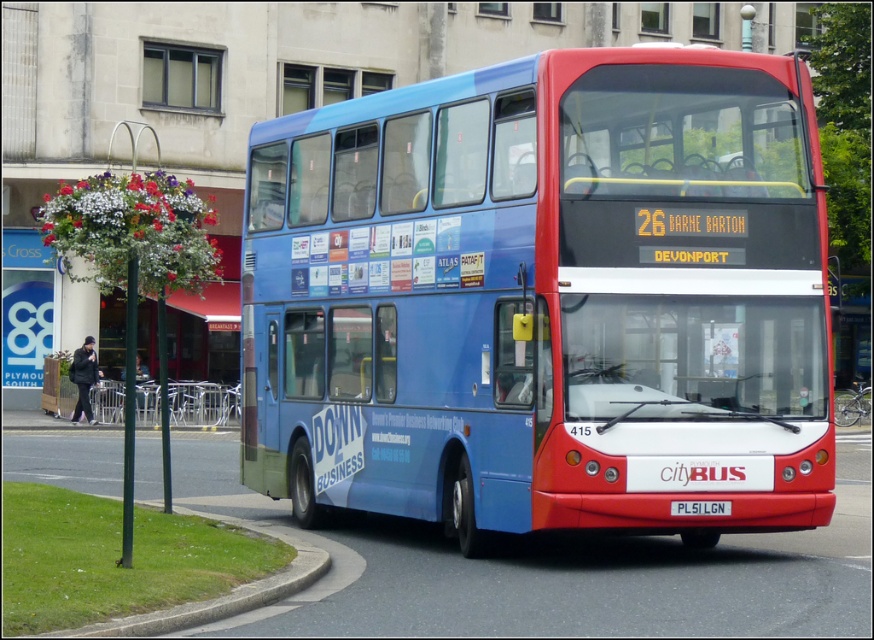
In the scene shown: You are a city planner analyzing traffic flow. The blue matte bus at center is at coordinates 0.467, 0.624. If you need to place a traffic light that must be 0.5 meters away from the bus, where should you position it relative to the bus?

The traffic light should be placed 0.5 meters away from the blue matte bus at center. Since the bus is at coordinates (545, 298), the traffic light can be positioned either to the front, back, left, or right side of the bus, maintaining the 0.5 meter distance.

You are standing at the edge of the road where the blue matte bus at center is parked. If you want to take a photo of the bus with your smartphone, which has a maximum focus range of 10 meters, will the camera be able to focus on the bus?

The blue matte bus at center is 9.35 meters away from the camera. Since the maximum focus range is 10 meters, the camera can focus on the bus as it is within range.

You are a delivery person trying to place a large package on the roof of the blue matte bus at center. The package requires a minimum clearance of 5 feet between the top of the bus and any nearby obstacles. The white plastic license plate at center is directly above the bus. Is there enough space for the package?

The blue matte bus at center and white plastic license plate at center are 5.16 feet apart. Since the license plate is directly above the bus and the required clearance is 5 feet, there is sufficient space as 5.16 feet exceeds the minimum requirement.